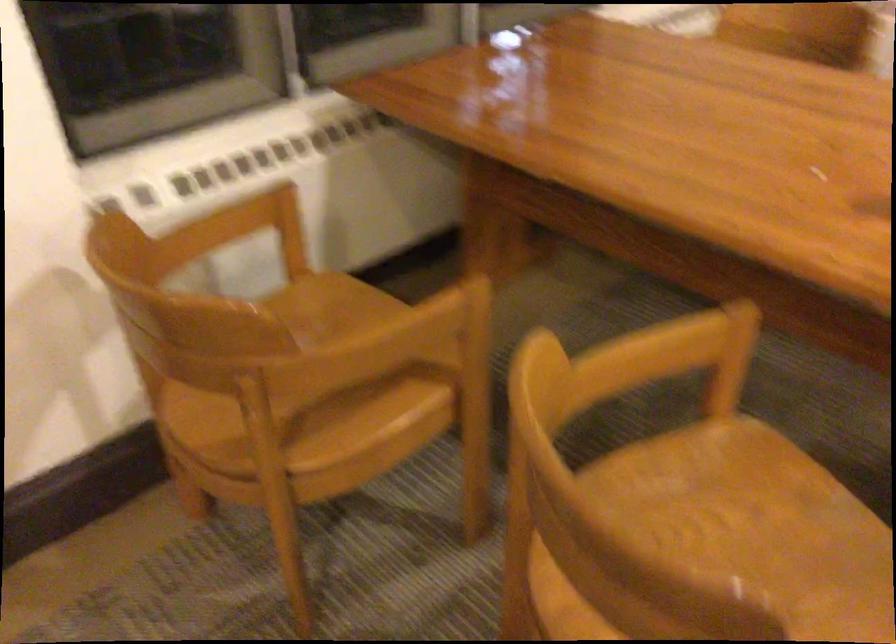
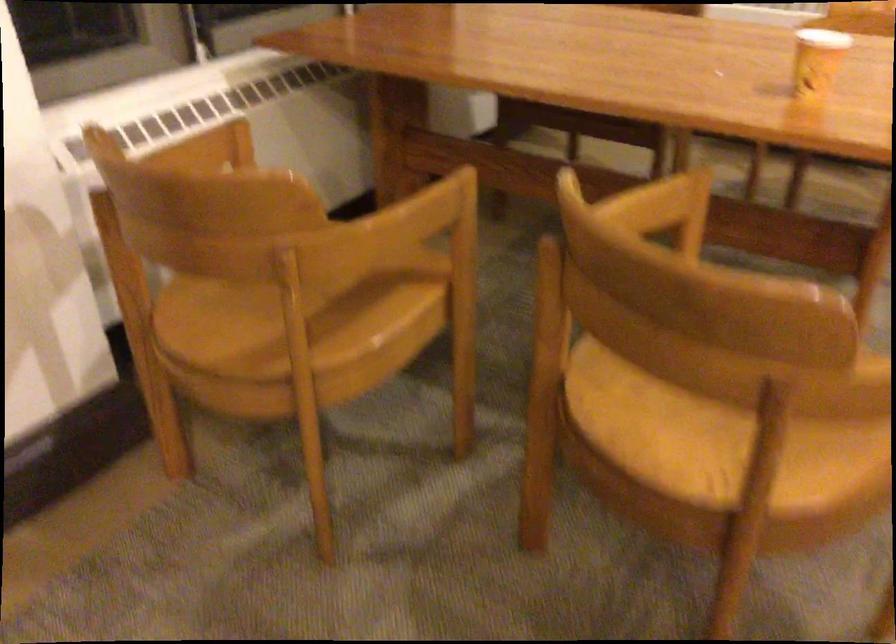
Find the pixel in the second image that matches pixel 675 345 in the first image.

(650, 205)